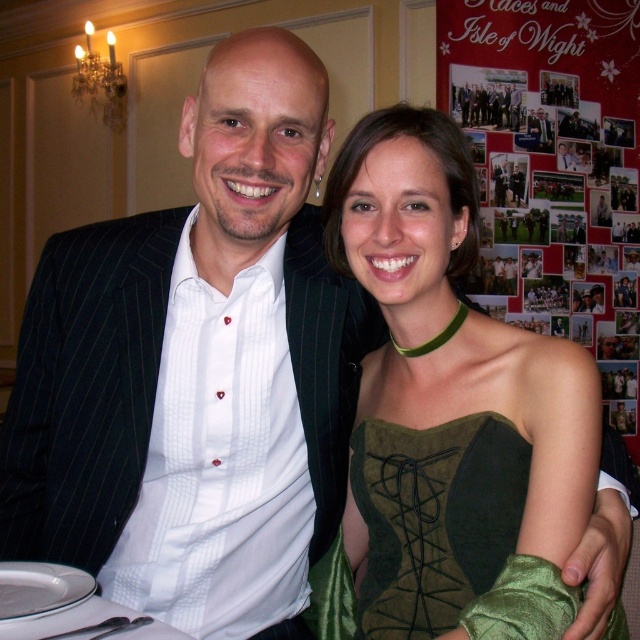
You are a photographer at a formal event. You need to capture a photo of the two people wearing the green suede dress at center and the green velvet corset at center. Which clothing item should you focus on if you want to highlight the larger one?

The green suede dress at center is larger in size than the green velvet corset at center, so you should focus on the green suede dress at center to highlight the larger one.

Consider the image. You are a photographer at this event and want to focus on the two points in the image. Which point, point 1 at coordinates (476, 456) or point 2 at coordinates (538, 138), is closer to you?

Point 1 at coordinates (476, 456) is closer to the viewer than point 2 at coordinates (538, 138).

You are a photographer at a formal event. You need to position a spotlight on the green suede dress at center and the matte black suit at center. Since the spotlight can only illuminate one side at a time, which side should you choose to highlight both outfits effectively?

The green suede dress at center is to the left of matte black suit at center. To highlight both effectively, position the spotlight on the left side so that it illuminates the green suede dress at center and the area extending towards the matte black suit at center.